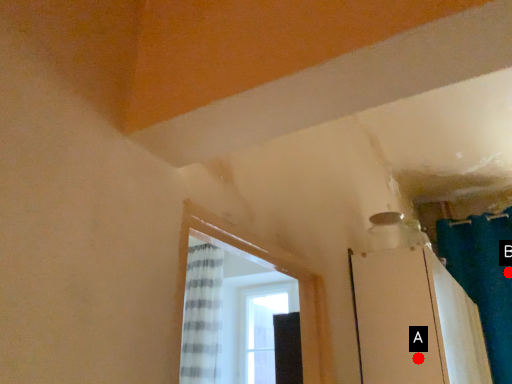
Question: Two points are circled on the image, labeled by A and B beside each circle. Which of the following is the farthest from the observer?

Choices:
 (A) A is further
 (B) B is further

Answer: (B)